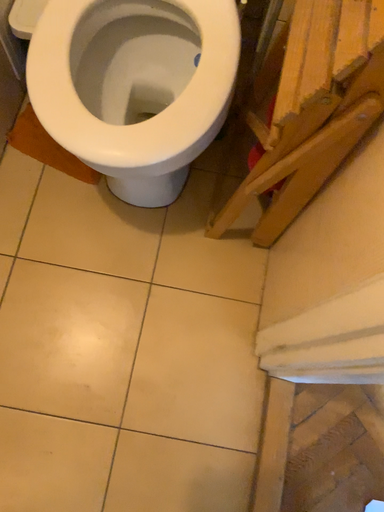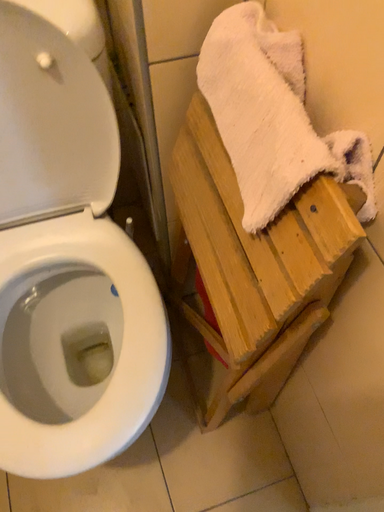
Question: How did the camera likely rotate when shooting the video?

Choices:
 (A) rotated downward
 (B) rotated upward

Answer: (B)